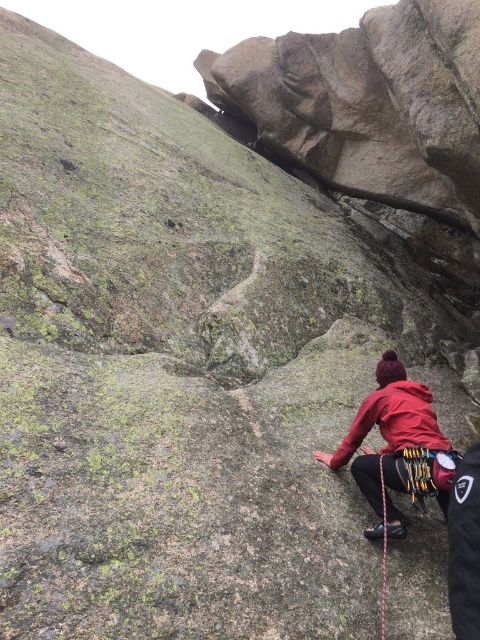
Does red fleece jacket at lower right appear on the left side of black nylon rope at lower right?

In fact, red fleece jacket at lower right is to the right of black nylon rope at lower right.

Locate an element on the screen. The height and width of the screenshot is (640, 480). red fleece jacket at lower right is located at coordinates [394, 436].

Locate an element on the screen. The image size is (480, 640). red fleece jacket at lower right is located at coordinates (394, 436).

Between red fleece jacket at lower right and red matte jacket at lower right, which one has less height?

Standing shorter between the two is red matte jacket at lower right.

Does point (377, 422) come farther from viewer compared to point (396, 394)?

That is True.

Locate an element on the screen. red fleece jacket at lower right is located at coordinates (394, 436).

Which is above, red matte jacket at lower right or black nylon rope at lower right?

red matte jacket at lower right is above.

Is red matte jacket at lower right taller than black nylon rope at lower right?

In fact, red matte jacket at lower right may be shorter than black nylon rope at lower right.

Looking at this image, who is more forward, (394, 388) or (384, 518)?

Point (384, 518)

Where is `red matte jacket at lower right`? red matte jacket at lower right is located at coordinates (394, 420).